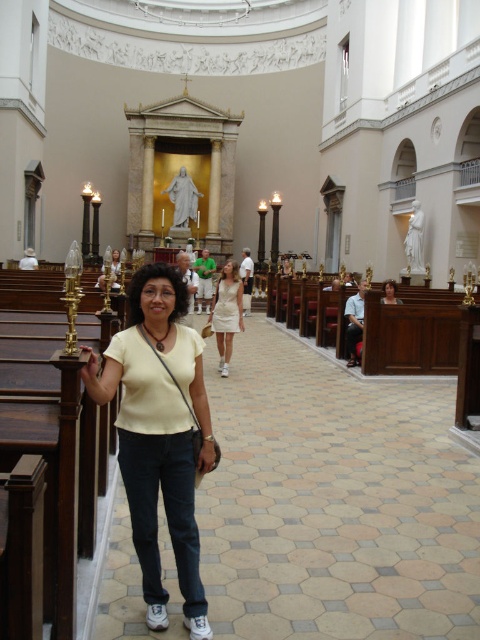
You are standing inside the grand classical church and want to determine which of the two points, point (120, 426) or point (384, 296), is closer to you. Based on the spatial arrangement, which point is nearer?

Point (120, 426) is closer to the camera than point (384, 296), so it is the nearer one.

You are standing at the entrance of the church and see both the yellow cotton shirt at center and the white cotton dress at center. Which one is closer to you?

The yellow cotton shirt at center is closer to you because it is in front of the white cotton dress at center.